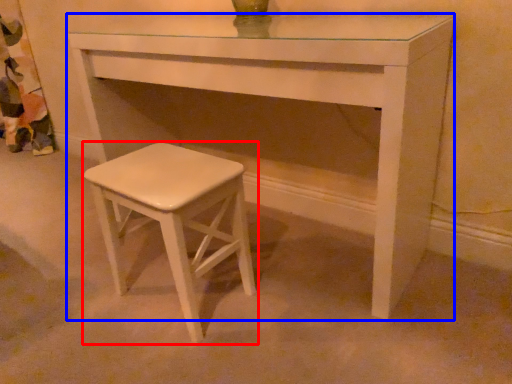
Question: Which object appears closest to the camera in this image, stool (highlighted by a red box) or table (highlighted by a blue box)?

Choices:
 (A) stool
 (B) table

Answer: (B)